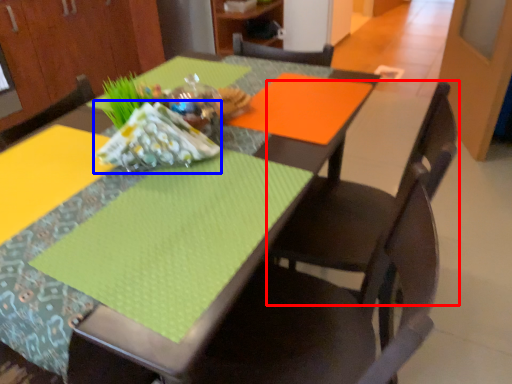
Question: Which object appears farthest to the camera in this image, chair (highlighted by a red box) or material (highlighted by a blue box)?

Choices:
 (A) chair
 (B) material

Answer: (A)